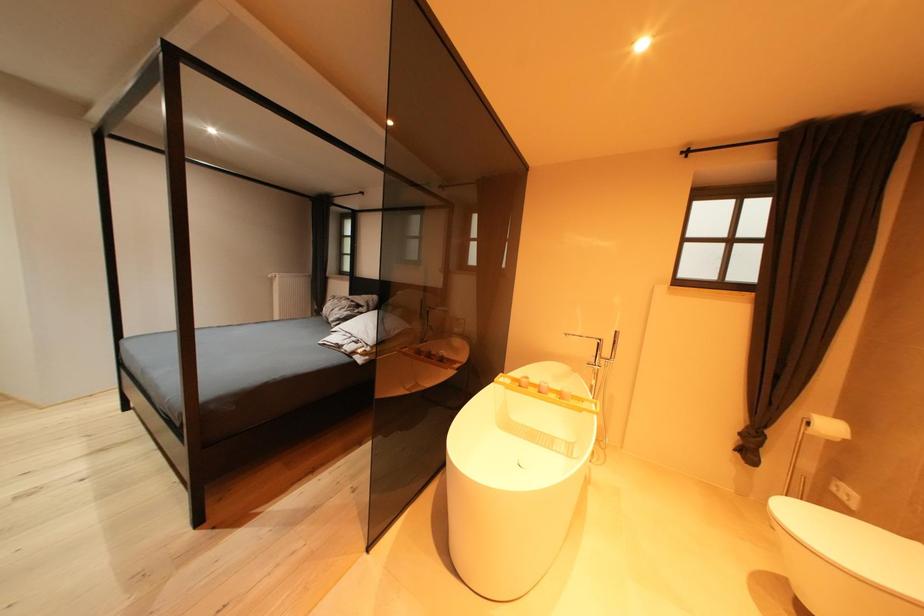
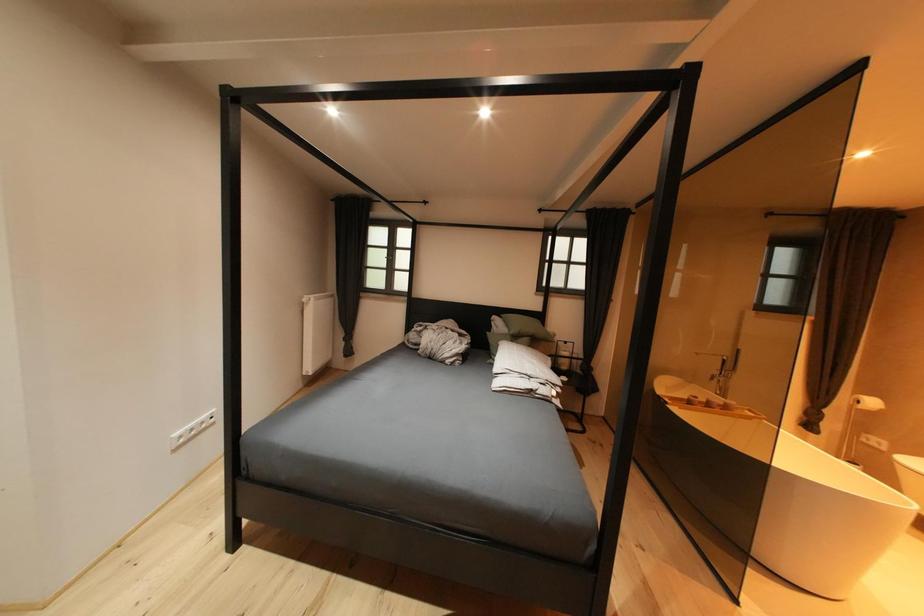
Question: What movement of the cameraman would produce the second image?

Choices:
 (A) Left
 (B) Right
 (C) Forward
 (D) Backward

Answer: (A)